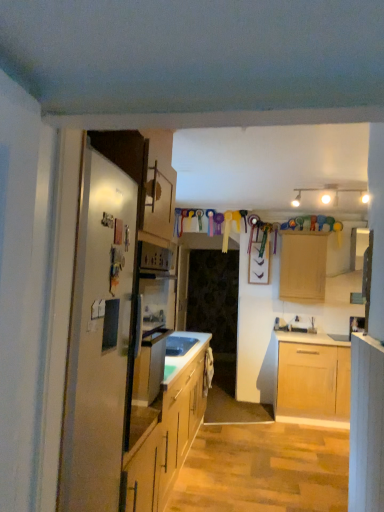
Question: Does transparent glass door at center appear on the left side of light wood cabinet at right, the second cabinetry viewed from the back?

Choices:
 (A) yes
 (B) no

Answer: (A)

Question: From the image's perspective, is transparent glass door at center on light wood cabinet at right, placed as the first cabinetry when sorted from left to right?

Choices:
 (A) yes
 (B) no

Answer: (B)

Question: Is transparent glass door at center smaller than light wood cabinet at right, which is the first cabinetry from front to back?

Choices:
 (A) no
 (B) yes

Answer: (A)

Question: Considering the relative sizes of transparent glass door at center and light wood cabinet at right, the second cabinetry viewed from the back, in the image provided, is transparent glass door at center bigger than light wood cabinet at right, the second cabinetry viewed from the back,?

Choices:
 (A) no
 (B) yes

Answer: (B)

Question: Considering the relative sizes of transparent glass door at center and light wood cabinet at right, which is the first cabinetry from front to back, in the image provided, is transparent glass door at center shorter than light wood cabinet at right, which is the first cabinetry from front to back,?

Choices:
 (A) no
 (B) yes

Answer: (A)

Question: Does transparent glass door at center have a greater width compared to light wood cabinet at right, which is the first cabinetry from front to back?

Choices:
 (A) yes
 (B) no

Answer: (B)

Question: Does light wood cabinet at upper center, which appears as the second cabinetry when viewed from the left, come behind light wood cabinet at right, placed as the first cabinetry when sorted from left to right?

Choices:
 (A) yes
 (B) no

Answer: (A)

Question: From a real-world perspective, is light wood cabinet at upper center, marked as the first cabinetry in a back-to-front arrangement, located higher than light wood cabinet at right, placed as the first cabinetry when sorted from left to right?

Choices:
 (A) no
 (B) yes

Answer: (B)

Question: Could you tell me if light wood cabinet at upper center, the second cabinetry viewed from the front, is turned towards light wood cabinet at right, which is the first cabinetry from front to back?

Choices:
 (A) yes
 (B) no

Answer: (A)

Question: Does light wood cabinet at upper center, which is counted as the first cabinetry, starting from the right, touch light wood cabinet at right, placed as the first cabinetry when sorted from left to right?

Choices:
 (A) yes
 (B) no

Answer: (B)

Question: Is light wood cabinet at upper center, the second cabinetry viewed from the front, smaller than light wood cabinet at right, the second cabinetry viewed from the back?

Choices:
 (A) no
 (B) yes

Answer: (A)

Question: Is light wood cabinet at right, the second cabinetry viewed from the back, at the back of light wood cabinet at upper center, the second cabinetry viewed from the front?

Choices:
 (A) yes
 (B) no

Answer: (B)

Question: Is satin silver refrigerator at left closer to the viewer compared to transparent glass door at center?

Choices:
 (A) no
 (B) yes

Answer: (B)